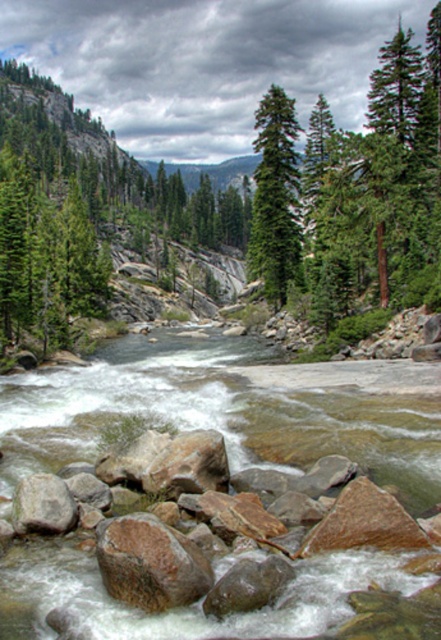
Between point (67, 385) and point (254, 225), which one is positioned in front?

Positioned in front is point (67, 385).

Is brown rock river at center wider than green matte tree at center?

Correct, the width of brown rock river at center exceeds that of green matte tree at center.

This screenshot has height=640, width=441. I want to click on brown rock river at center, so click(x=216, y=413).

What are the coordinates of `brown rock river at center` in the screenshot? It's located at (216, 413).

Based on the photo, does green matte tree at center have a lesser width compared to brown rough rock at center?

In fact, green matte tree at center might be wider than brown rough rock at center.

Which is behind, point (276, 163) or point (175, 596)?

The point (276, 163) is behind.

Find the location of a particular element. Image resolution: width=441 pixels, height=640 pixels. green matte tree at center is located at coordinates pos(276,196).

Can you confirm if brown rough rock at center is taller than brown rough rock at lower left?

Correct, brown rough rock at center is much taller as brown rough rock at lower left.

Is brown rough rock at center smaller than brown rough rock at lower left?

No, brown rough rock at center is not smaller than brown rough rock at lower left.

What are the coordinates of `brown rough rock at center` in the screenshot? It's located at (150, 563).